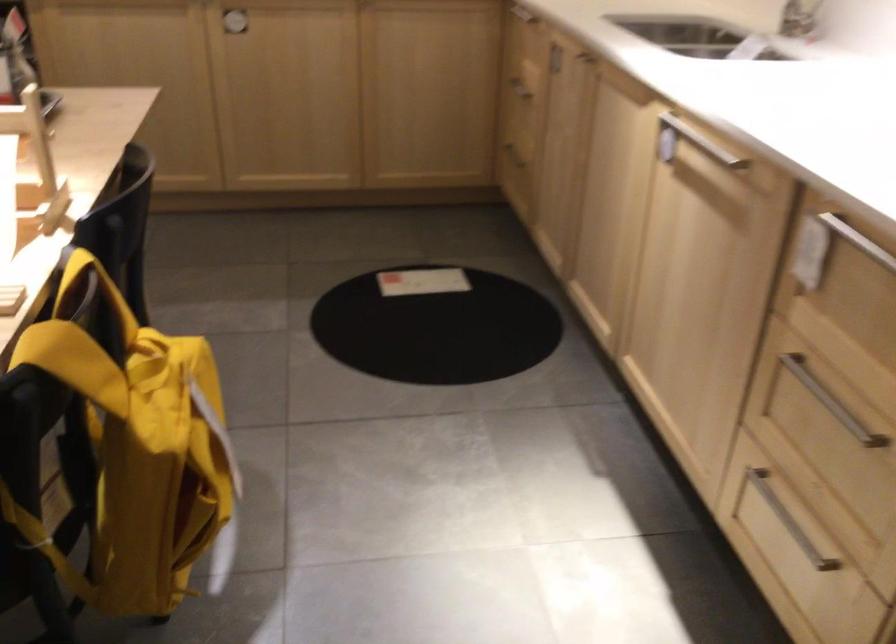
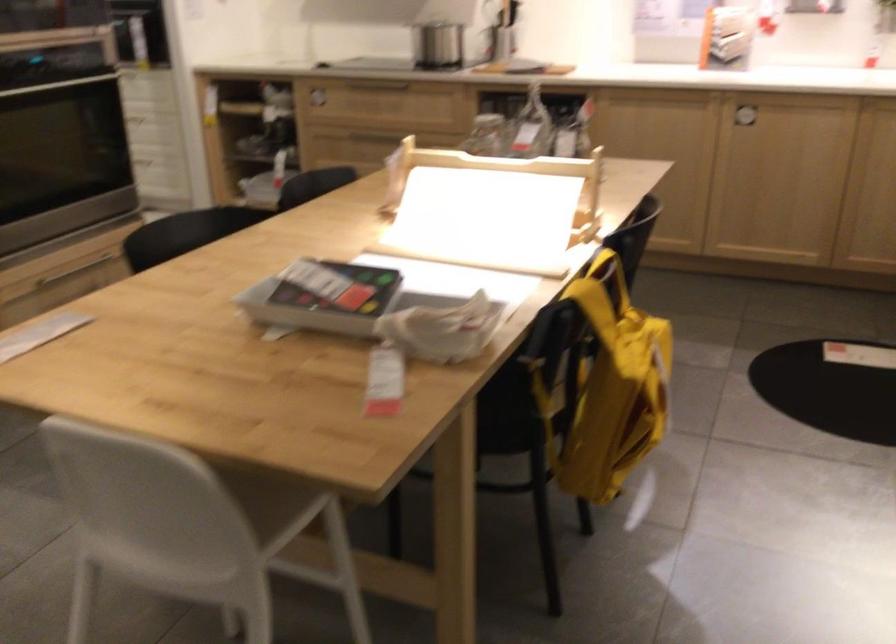
Find the pixel in the second image that matches the point at 330,404 in the first image.

(760, 419)